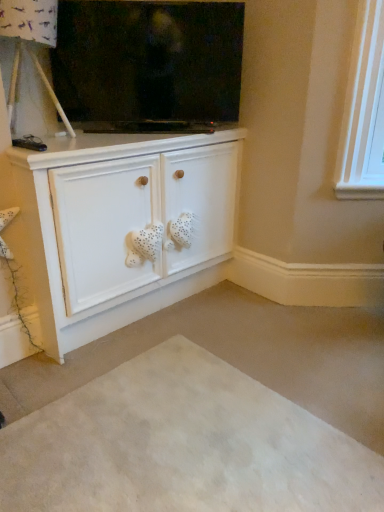
Question: From a real-world perspective, is beige carpet at lower center positioned under white matte cabinet at center based on gravity?

Choices:
 (A) no
 (B) yes

Answer: (B)

Question: Does beige carpet at lower center have a larger size compared to white matte cabinet at center?

Choices:
 (A) no
 (B) yes

Answer: (A)

Question: Does beige carpet at lower center come behind white matte cabinet at center?

Choices:
 (A) yes
 (B) no

Answer: (B)

Question: Considering the relative sizes of beige carpet at lower center and white matte cabinet at center in the image provided, is beige carpet at lower center shorter than white matte cabinet at center?

Choices:
 (A) yes
 (B) no

Answer: (A)

Question: Does beige carpet at lower center have a lesser width compared to white matte cabinet at center?

Choices:
 (A) yes
 (B) no

Answer: (B)

Question: Would you say white matte cabinet at center is to the left or to the right of beige carpet at lower center in the picture?

Choices:
 (A) right
 (B) left

Answer: (B)

Question: From a real-world perspective, relative to beige carpet at lower center, is white matte cabinet at center vertically above or below?

Choices:
 (A) below
 (B) above

Answer: (B)

Question: Would you say white matte cabinet at center is inside or outside beige carpet at lower center?

Choices:
 (A) outside
 (B) inside

Answer: (A)

Question: Is white matte cabinet at center taller or shorter than beige carpet at lower center?

Choices:
 (A) short
 (B) tall

Answer: (B)

Question: From the image's perspective, is white matte cabinet at center located above or below flat screen tv at upper center?

Choices:
 (A) above
 (B) below

Answer: (B)

Question: From a real-world perspective, is white matte cabinet at center positioned above or below flat screen tv at upper center?

Choices:
 (A) above
 (B) below

Answer: (B)

Question: Based on their positions, is white matte cabinet at center located to the left or right of flat screen tv at upper center?

Choices:
 (A) right
 (B) left

Answer: (B)

Question: Based on their sizes in the image, would you say white matte cabinet at center is bigger or smaller than flat screen tv at upper center?

Choices:
 (A) big
 (B) small

Answer: (A)

Question: Is flat screen tv at upper center wider or thinner than beige carpet at lower center?

Choices:
 (A) thin
 (B) wide

Answer: (A)

Question: From a real-world perspective, is flat screen tv at upper center above or below beige carpet at lower center?

Choices:
 (A) below
 (B) above

Answer: (B)